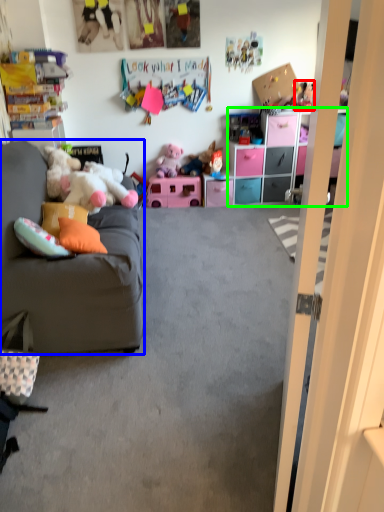
Question: Based on their relative distances, which object is nearer to toy (highlighted by a red box)? Choose from studio couch (highlighted by a blue box) and cabinetry (highlighted by a green box).

Choices:
 (A) studio couch
 (B) cabinetry

Answer: (B)